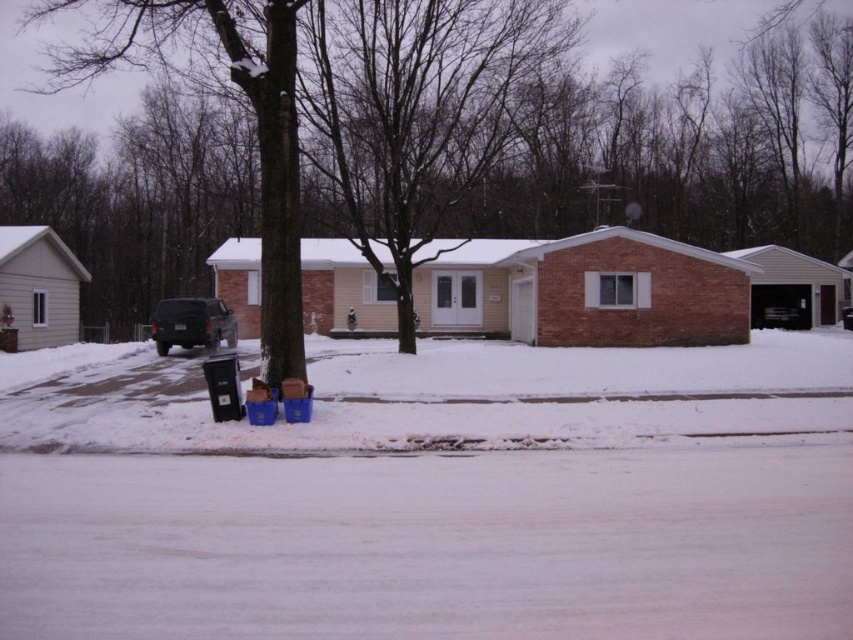
Between white powdery snow at lower center and matte black suv at center, which one is positioned lower?

white powdery snow at lower center is lower down.

Who is more forward, (163, 547) or (183, 305)?

Point (163, 547)

Who is more distant from viewer, (x=444, y=460) or (x=171, y=304)?

The point (x=171, y=304) is behind.

I want to click on white powdery snow at lower center, so click(x=434, y=497).